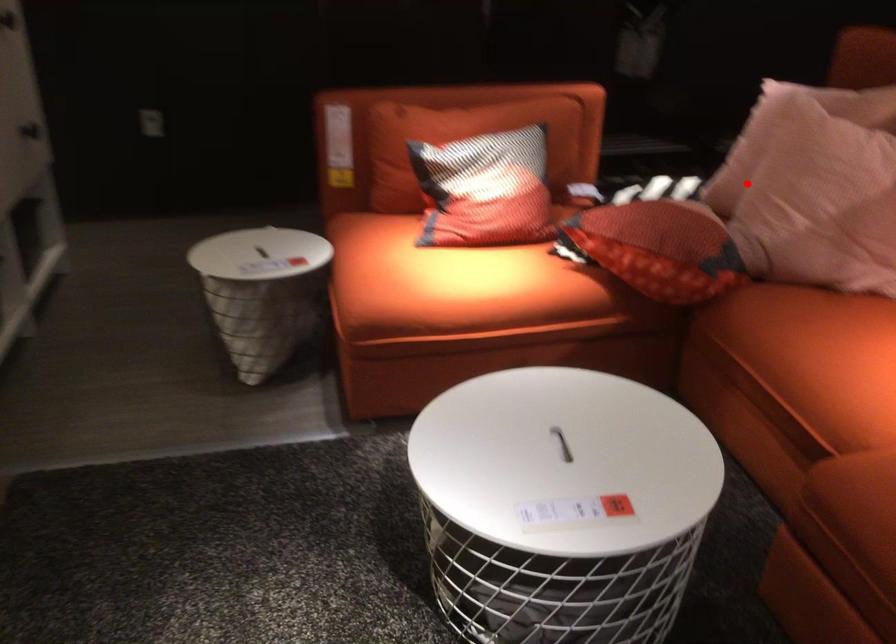
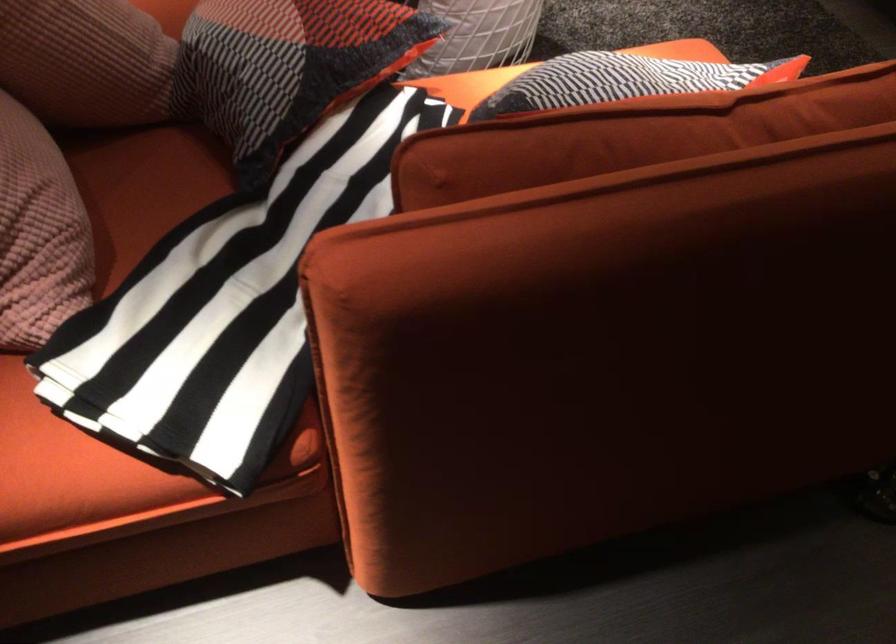
Question: I am providing you with two images of the same scene from different viewpoints. A red point is shown in image1. For the corresponding object point in image2, is it positioned nearer or farther from the camera?

Choices:
 (A) Nearer
 (B) Farther

Answer: (A)